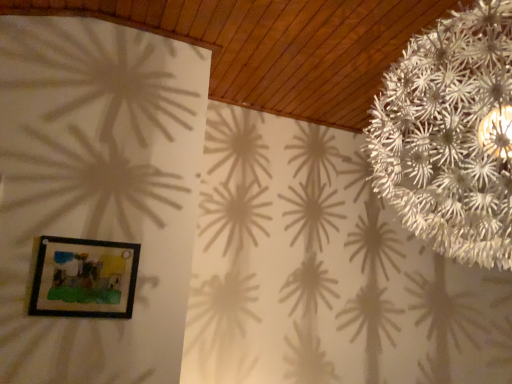
Question: From a real-world perspective, is white paper flower at upper right beneath wooden framed picture at lower left?

Choices:
 (A) yes
 (B) no

Answer: (B)

Question: Is white paper flower at upper right facing towards wooden framed picture at lower left?

Choices:
 (A) yes
 (B) no

Answer: (B)

Question: Can you confirm if white paper flower at upper right is thinner than wooden framed picture at lower left?

Choices:
 (A) yes
 (B) no

Answer: (B)

Question: Considering the relative positions of white paper flower at upper right and wooden framed picture at lower left in the image provided, is white paper flower at upper right behind wooden framed picture at lower left?

Choices:
 (A) no
 (B) yes

Answer: (A)

Question: Does white paper flower at upper right have a greater width compared to wooden framed picture at lower left?

Choices:
 (A) yes
 (B) no

Answer: (A)

Question: From the image's perspective, is white paper flower at upper right below wooden framed picture at lower left?

Choices:
 (A) no
 (B) yes

Answer: (A)

Question: Considering the relative sizes of wooden framed picture at lower left and white paper flower at upper right in the image provided, is wooden framed picture at lower left shorter than white paper flower at upper right?

Choices:
 (A) yes
 (B) no

Answer: (A)

Question: From the image's perspective, is wooden framed picture at lower left located above white paper flower at upper right?

Choices:
 (A) yes
 (B) no

Answer: (B)

Question: Considering the relative positions of wooden framed picture at lower left and white paper flower at upper right in the image provided, is wooden framed picture at lower left to the left of white paper flower at upper right from the viewer's perspective?

Choices:
 (A) no
 (B) yes

Answer: (B)

Question: Considering the relative sizes of wooden framed picture at lower left and white paper flower at upper right in the image provided, is wooden framed picture at lower left smaller than white paper flower at upper right?

Choices:
 (A) yes
 (B) no

Answer: (A)

Question: Considering the relative sizes of wooden framed picture at lower left and white paper flower at upper right in the image provided, is wooden framed picture at lower left thinner than white paper flower at upper right?

Choices:
 (A) no
 (B) yes

Answer: (B)

Question: Is wooden framed picture at lower left far away from white paper flower at upper right?

Choices:
 (A) yes
 (B) no

Answer: (A)

Question: Is wooden framed picture at lower left bigger or smaller than white paper flower at upper right?

Choices:
 (A) small
 (B) big

Answer: (A)